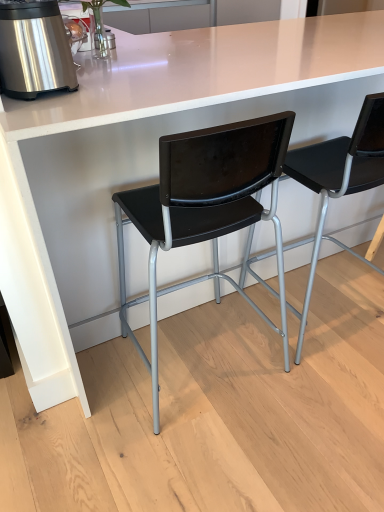
Question: Which direction should I rotate to look at black plastic chair at center, which is counted as the 2th chair, starting from the right, — up or down?

Choices:
 (A) up
 (B) down

Answer: (B)

Question: Considering the relative positions of stainless steel appliance at left and black plastic chair at center, which appears as the first chair when viewed from the right, in the image provided, is stainless steel appliance at left to the right of black plastic chair at center, which appears as the first chair when viewed from the right, from the viewer's perspective?

Choices:
 (A) no
 (B) yes

Answer: (A)

Question: Is stainless steel appliance at left wider than black plastic chair at center, which appears as the first chair when viewed from the right?

Choices:
 (A) yes
 (B) no

Answer: (B)

Question: Is stainless steel appliance at left touching black plastic chair at center, positioned as the second chair in left-to-right order?

Choices:
 (A) no
 (B) yes

Answer: (A)

Question: Would you say stainless steel appliance at left contains black plastic chair at center, positioned as the second chair in left-to-right order?

Choices:
 (A) yes
 (B) no

Answer: (B)

Question: From a real-world perspective, is stainless steel appliance at left on top of black plastic chair at center, which appears as the first chair when viewed from the right?

Choices:
 (A) yes
 (B) no

Answer: (A)

Question: From the image's perspective, would you say stainless steel appliance at left is positioned over black plastic chair at center, which appears as the first chair when viewed from the right?

Choices:
 (A) no
 (B) yes

Answer: (B)

Question: Is stainless steel appliance at left oriented towards black plastic chair at center, which is the first chair from left to right?

Choices:
 (A) yes
 (B) no

Answer: (B)

Question: Is the position of stainless steel appliance at left less distant than that of black plastic chair at center, which is counted as the 2th chair, starting from the right?

Choices:
 (A) yes
 (B) no

Answer: (B)

Question: Is stainless steel appliance at left thinner than black plastic chair at center, which is the first chair from left to right?

Choices:
 (A) yes
 (B) no

Answer: (A)

Question: From the image's perspective, is stainless steel appliance at left located above black plastic chair at center, which is counted as the 2th chair, starting from the right?

Choices:
 (A) no
 (B) yes

Answer: (B)

Question: Is stainless steel appliance at left bigger than black plastic chair at center, which is the first chair from left to right?

Choices:
 (A) yes
 (B) no

Answer: (B)

Question: Is black plastic chair at center, which is counted as the 2th chair, starting from the right, completely or partially inside stainless steel appliance at left?

Choices:
 (A) yes
 (B) no

Answer: (B)

Question: Can you see black plastic chair at center, which is the first chair from left to right, touching stainless steel appliance at left?

Choices:
 (A) yes
 (B) no

Answer: (B)